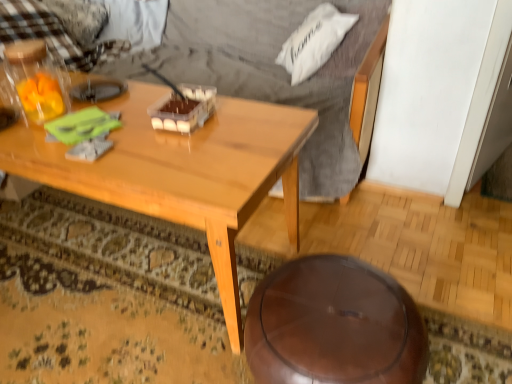
Find the location of `free spot to the right of translucent plastic bottle at upper left`. free spot to the right of translucent plastic bottle at upper left is located at coordinates (126, 104).